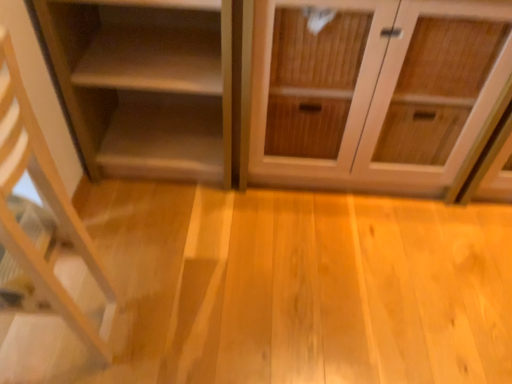
Question: In the image, is light wood shelf at left, which appears as the 1th shelf when viewed from the front, positioned in front of or behind wooden cabinet at center?

Choices:
 (A) front
 (B) behind

Answer: (A)

Question: From the image's perspective, is light wood shelf at left, which appears as the 1th shelf when viewed from the front, positioned above or below wooden cabinet at center?

Choices:
 (A) above
 (B) below

Answer: (B)

Question: Considering the real-world distances, which object is closest to the light wood shelf at left, the 2th shelf positioned from the back?

Choices:
 (A) matte wood shelf at left, the second shelf from the front
 (B) wooden cabinet at center

Answer: (A)

Question: Which object is the farthest from the wooden cabinet at center?

Choices:
 (A) matte wood shelf at left, the second shelf from the front
 (B) light wood shelf at left, which appears as the 1th shelf when viewed from the front

Answer: (B)